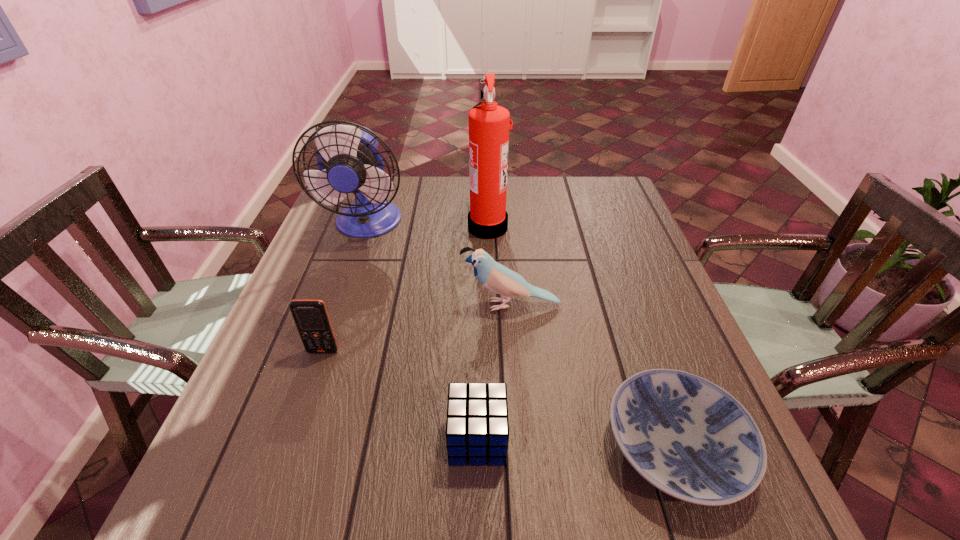
Find the location of a particular element. the tallest object is located at coordinates (489, 127).

In order to click on the second tallest object in this screenshot , I will do `click(349, 161)`.

The height and width of the screenshot is (540, 960). Find the location of `the third farthest object`. the third farthest object is located at coordinates (497, 278).

At what (x,y) coordinates should I click in order to perform the action: click on the fourth tallest object. Please return your answer as a coordinate pair (x, y). The width and height of the screenshot is (960, 540). Looking at the image, I should click on (311, 317).

Locate an element on the screen. The image size is (960, 540). the third nearest object is located at coordinates (311, 317).

Find the location of a particular element. cube is located at coordinates (477, 428).

I want to click on plate, so click(688, 437).

Identify the location of the rightmost object. The width and height of the screenshot is (960, 540). (688, 437).

Identify the location of free space located with the nozzle aimed from the fire extinguisher. Image resolution: width=960 pixels, height=540 pixels. pos(386,226).

Identify the location of free region located with the nozzle aimed from the fire extinguisher. The height and width of the screenshot is (540, 960). (427, 226).